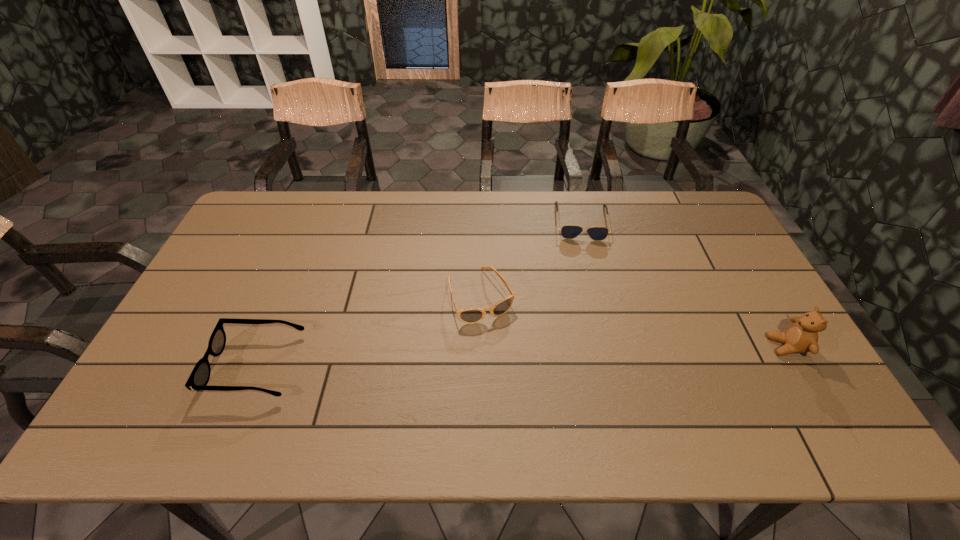
The image size is (960, 540). Identify the location of spectacles. 199,377.

Find the location of a particular element. The width and height of the screenshot is (960, 540). the rightmost object is located at coordinates (801, 337).

The width and height of the screenshot is (960, 540). I want to click on the tallest object, so click(801, 337).

I want to click on the second object from left to right, so click(470, 316).

Identify the location of the third nearest object. (470, 316).

Image resolution: width=960 pixels, height=540 pixels. Find the location of `the farthest object`. the farthest object is located at coordinates (568, 231).

Identify the location of the second object from right to left. (568, 231).

I want to click on vacant space located 0.120m on the arms of the leftmost object, so click(x=168, y=366).

The image size is (960, 540). What are the coordinates of `free space located 0.130m on the arms of the leftmost object` in the screenshot? It's located at (164, 366).

Find the location of a particular element. The height and width of the screenshot is (540, 960). free space located on the arms of the leftmost object is located at coordinates (164, 366).